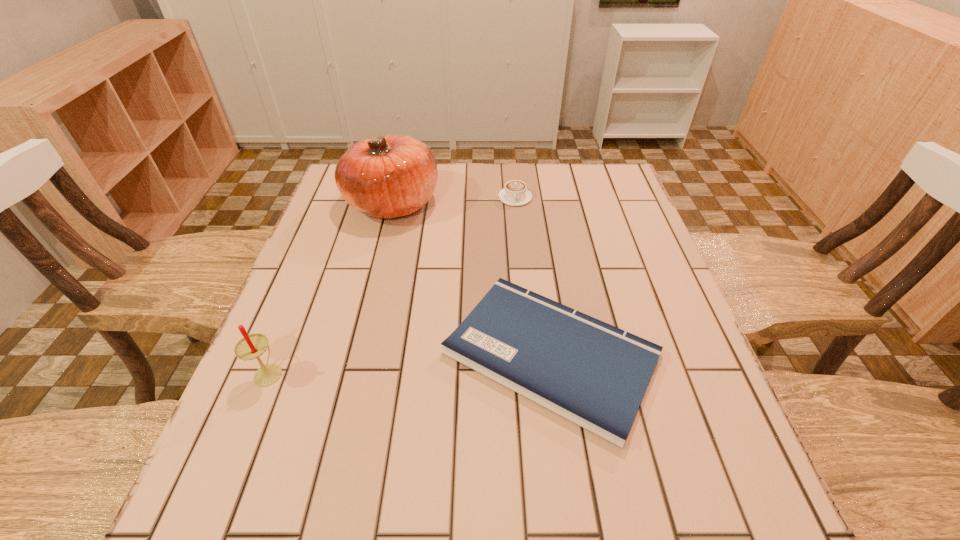
You are a GUI agent. You are given a task and a screenshot of the screen. Output one action in this format:
    pyautogui.click(x=<x>, y=<y>)
    Task: Click on the pumpkin positioned at the left edge
    
    Given the screenshot: What is the action you would take?
    pyautogui.click(x=389, y=176)

This screenshot has height=540, width=960. I want to click on candle that is at the left edge, so click(252, 346).

Locate an element on the screen. object that is at the right edge is located at coordinates (594, 374).

The height and width of the screenshot is (540, 960). Identify the location of object positioned at the far left corner. (389, 176).

At what (x,y) coordinates should I click in order to perform the action: click on free space at the near edge. Please return your answer as a coordinate pair (x, y). Looking at the image, I should click on (456, 502).

In order to click on vacant space at the left edge of the desktop in this screenshot , I will do `click(306, 342)`.

In the image, there is a desktop. Identify the location of free space at the right edge. (609, 267).

Locate an element on the screen. free space at the far right corner of the desktop is located at coordinates (605, 205).

Locate an element on the screen. The image size is (960, 540). vacant space at the near right corner is located at coordinates (681, 519).

The image size is (960, 540). I want to click on vacant area that lies between the cappuccino and the candle, so click(x=392, y=285).